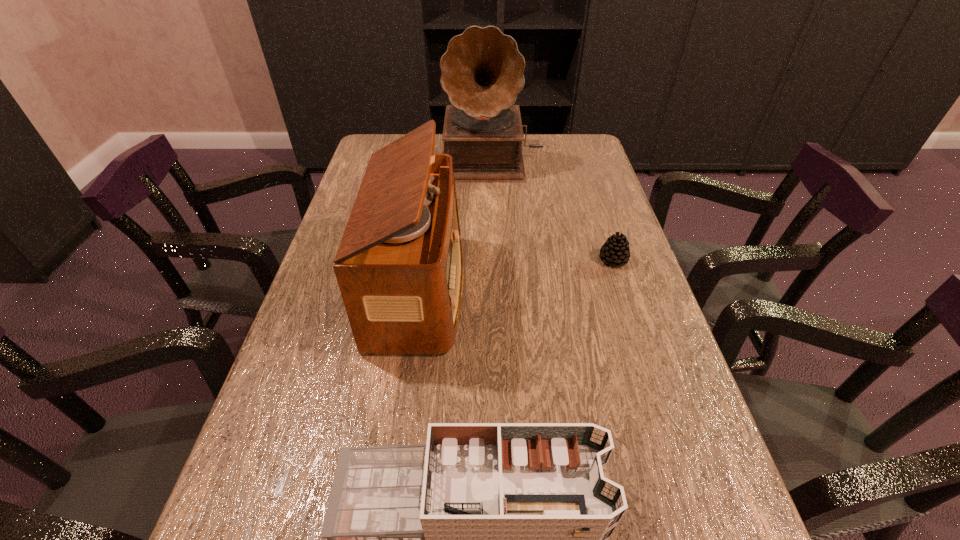
You are a GUI agent. You are given a task and a screenshot of the screen. Output one action in this format:
    pyautogui.click(x=<x>, y=<y>)
    Task: Click on the record player
    The image size is (960, 540).
    Given the screenshot: What is the action you would take?
    pyautogui.click(x=482, y=70)

Locate an element on the screen. The image size is (960, 540). the tallest object is located at coordinates (482, 70).

Where is `radio receiver`? Image resolution: width=960 pixels, height=540 pixels. radio receiver is located at coordinates (399, 266).

You are a GUI agent. You are given a task and a screenshot of the screen. Output one action in this format:
    pyautogui.click(x=<x>, y=<y>)
    Task: Click on the rightmost object
    This screenshot has height=540, width=960.
    Given the screenshot: What is the action you would take?
    pyautogui.click(x=616, y=251)

Where is `the shortest object`? This screenshot has width=960, height=540. the shortest object is located at coordinates (616, 251).

You are a GUI agent. You are given a task and a screenshot of the screen. Output one action in this format:
    pyautogui.click(x=<x>, y=<y>)
    Task: Click on the blank area located 0.180m from the horn of the tallest object
    The image size is (960, 540).
    Given the screenshot: What is the action you would take?
    pyautogui.click(x=494, y=218)

Locate an element on the screen. The height and width of the screenshot is (540, 960). vacant space located 0.290m on the front panel of the radio receiver is located at coordinates click(x=588, y=289).

I want to click on vacant space situated 0.200m at the narrow end of the rightmost object, so click(x=518, y=260).

Where is `vacant space located at the narrow end of the rightmost object`? The image size is (960, 540). vacant space located at the narrow end of the rightmost object is located at coordinates (542, 260).

Image resolution: width=960 pixels, height=540 pixels. I want to click on vacant space located at the narrow end of the rightmost object, so click(522, 260).